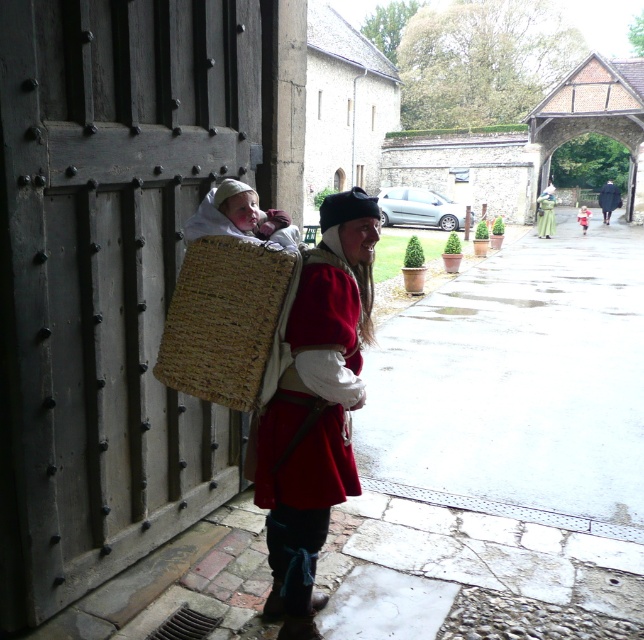
You are a costume designer preparing for a play. You need to ensure that the matte red coat at center will not be overwhelmed by the woven straw basket at center. Given their sizes, which item should you adjust in the design to maintain balance?

The matte red coat at center is larger than the woven straw basket at center. To maintain balance, you should adjust the size of the woven straw basket at center to make it larger so it can complement the coat without being overpowered.

You are an observer looking at the scene. You notice the woven straw basket at center and the soft beige fabric at center. Which object is located to the left?

The woven straw basket at center is positioned on the left side of the soft beige fabric at center, so the woven straw basket at center is to the left.